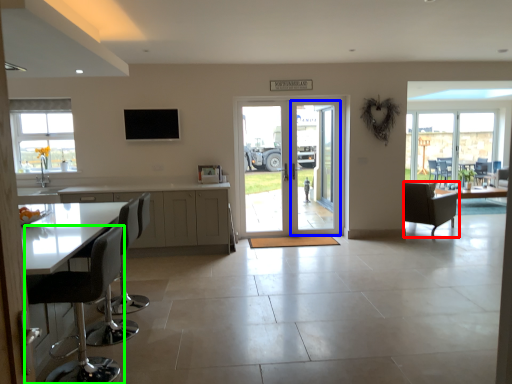
Question: Based on their relative distances, which object is farther from chair (highlighted by a red box)? Choose from screen door (highlighted by a blue box) and chair (highlighted by a green box).

Choices:
 (A) screen door
 (B) chair

Answer: (B)